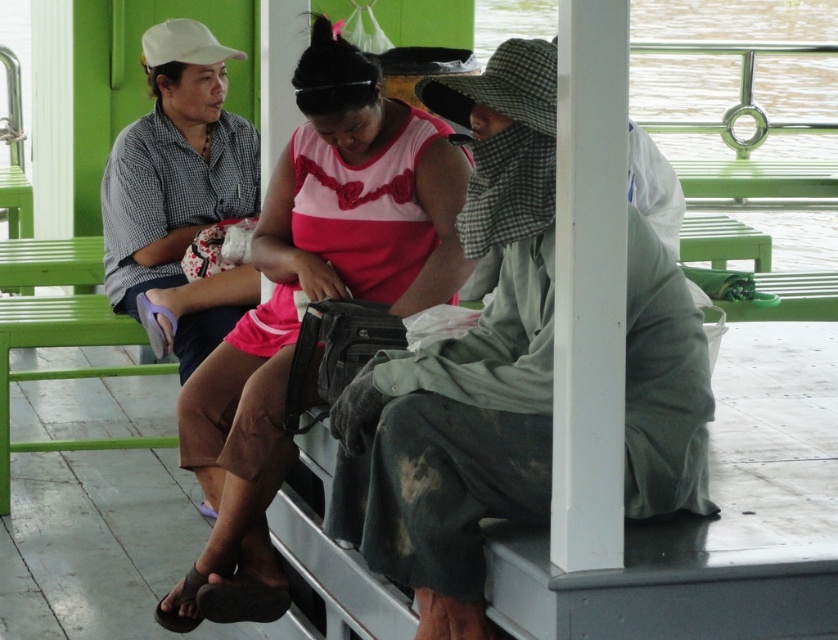
How much distance is there between green fabric hat at center and pink matte dress at center?

green fabric hat at center is 1.17 meters from pink matte dress at center.

Can you confirm if green fabric hat at center is taller than pink matte dress at center?

No, green fabric hat at center is not taller than pink matte dress at center.

Is point (688, 508) positioned after point (251, 593)?

No.

Where is `green fabric hat at center`? The height and width of the screenshot is (640, 838). green fabric hat at center is located at coordinates (464, 369).